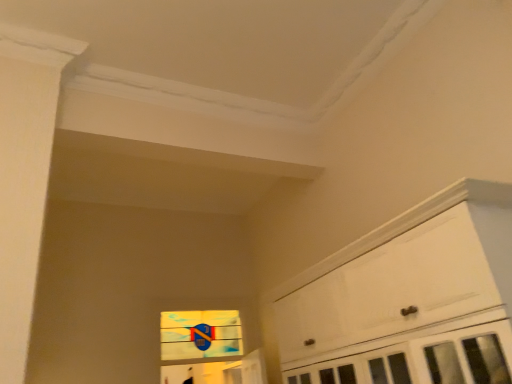
What do you see at coordinates (200, 334) in the screenshot? I see `painted wood window at center` at bounding box center [200, 334].

This screenshot has width=512, height=384. I want to click on painted wood window at center, so click(x=200, y=334).

Where is `painted wood window at center`? The height and width of the screenshot is (384, 512). painted wood window at center is located at coordinates (200, 334).